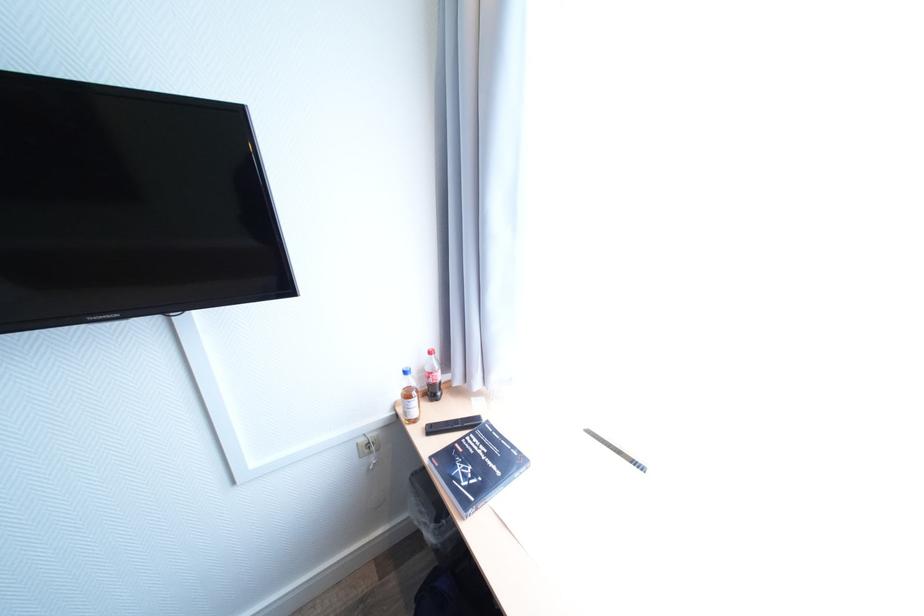
I want to click on power outlet socket, so click(x=368, y=445).